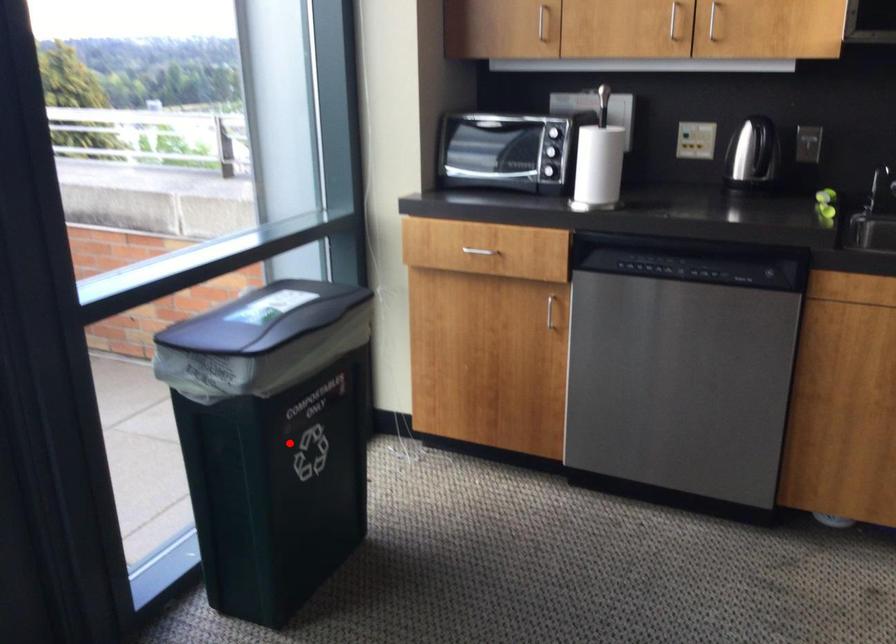
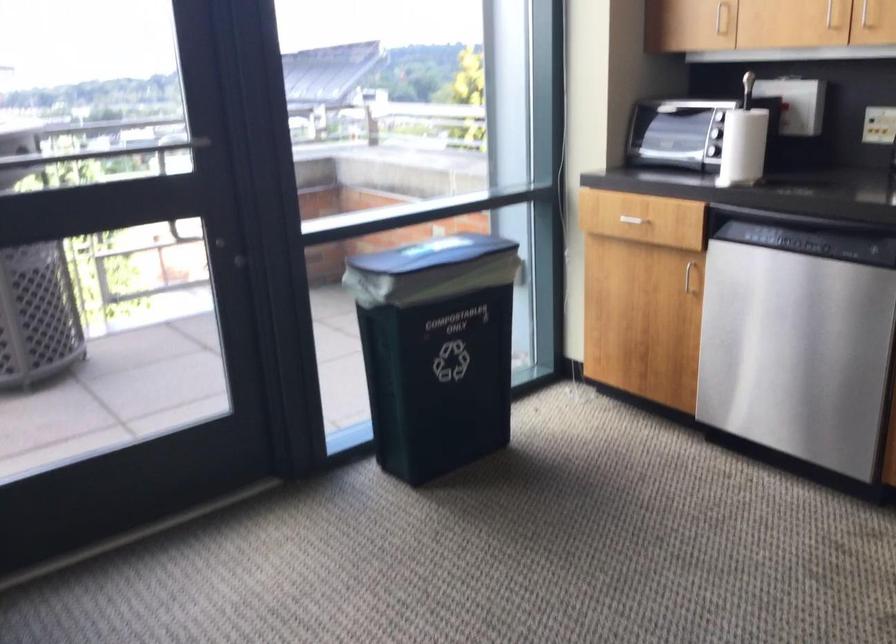
Question: I am providing you with two images of the same scene from different viewpoints. A red point is shown in image1. For the corresponding object point in image2, is it positioned nearer or farther from the camera?

Choices:
 (A) Nearer
 (B) Farther

Answer: (B)